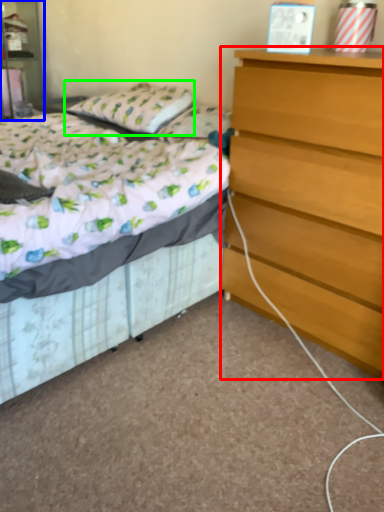
Question: Which object is the farthest from chest of drawers (highlighted by a red box)? Choose among these: nightstand (highlighted by a blue box) or pillow (highlighted by a green box).

Choices:
 (A) nightstand
 (B) pillow

Answer: (A)